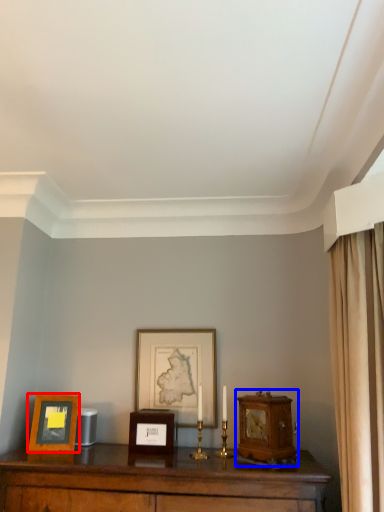
Question: Which object is closer to the camera taking this photo, picture frame (highlighted by a red box) or alarm clock (highlighted by a blue box)?

Choices:
 (A) picture frame
 (B) alarm clock

Answer: (B)